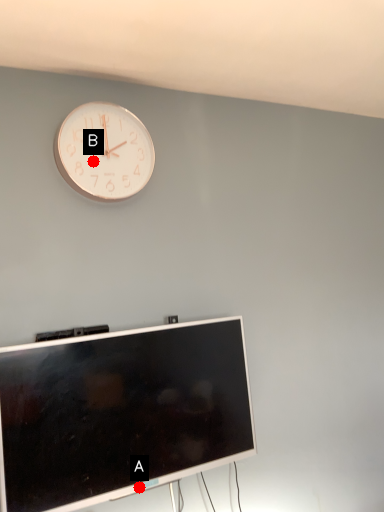
Question: Two points are circled on the image, labeled by A and B beside each circle. Which point appears farthest from the camera in this image?

Choices:
 (A) A is further
 (B) B is further

Answer: (B)